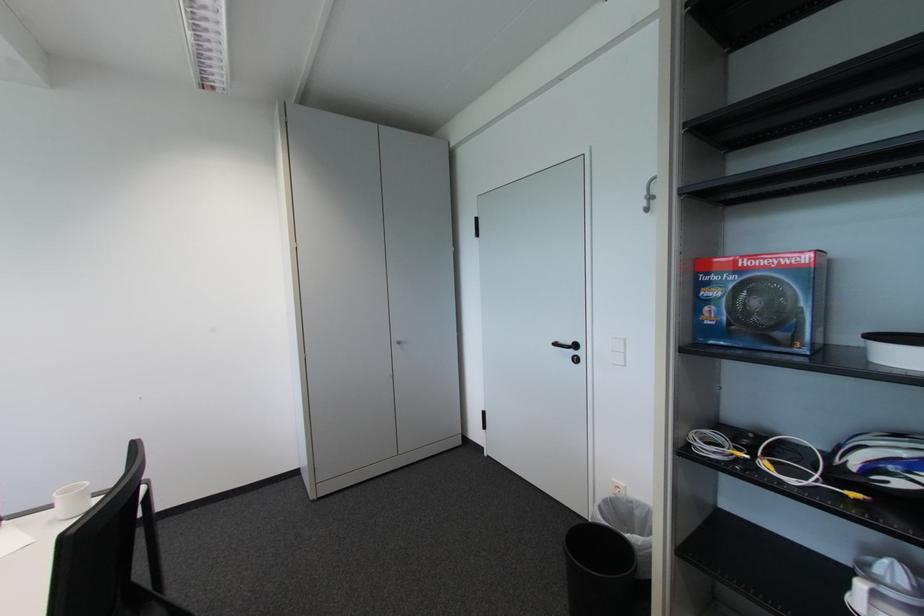
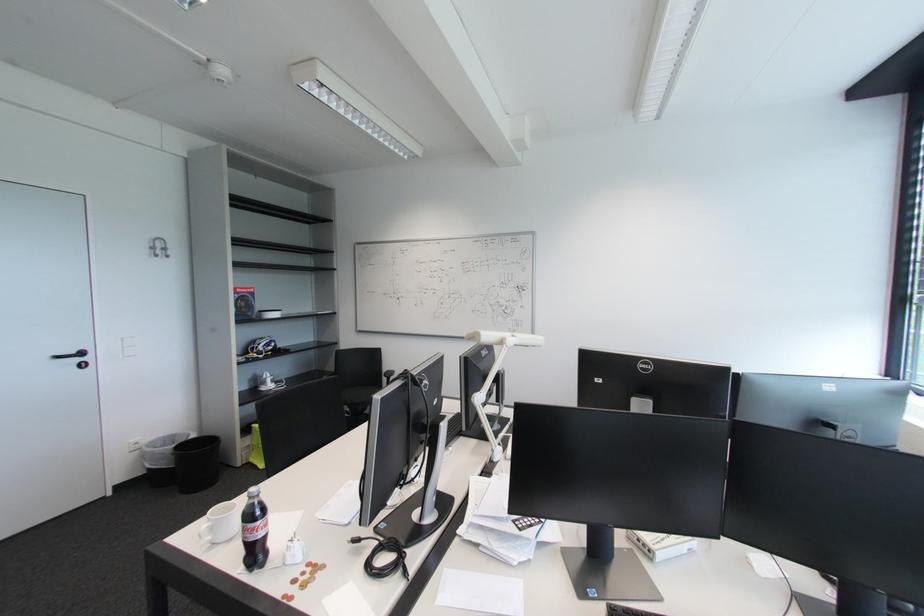
Locate, in the second image, the point that corresponds to [750,264] in the first image.

(246, 292)